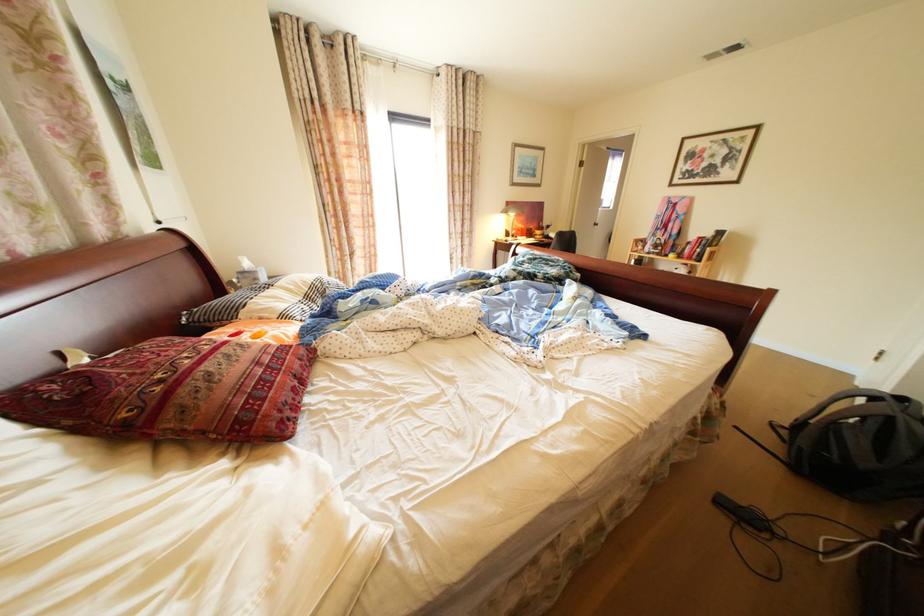
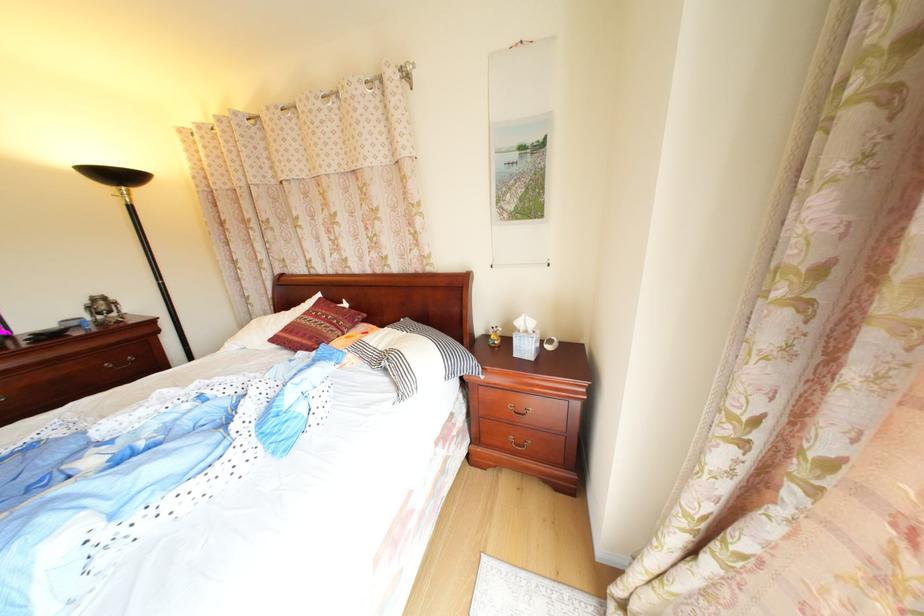
Locate, in the second image, the point that corresponds to point (309, 378) in the first image.

(304, 342)